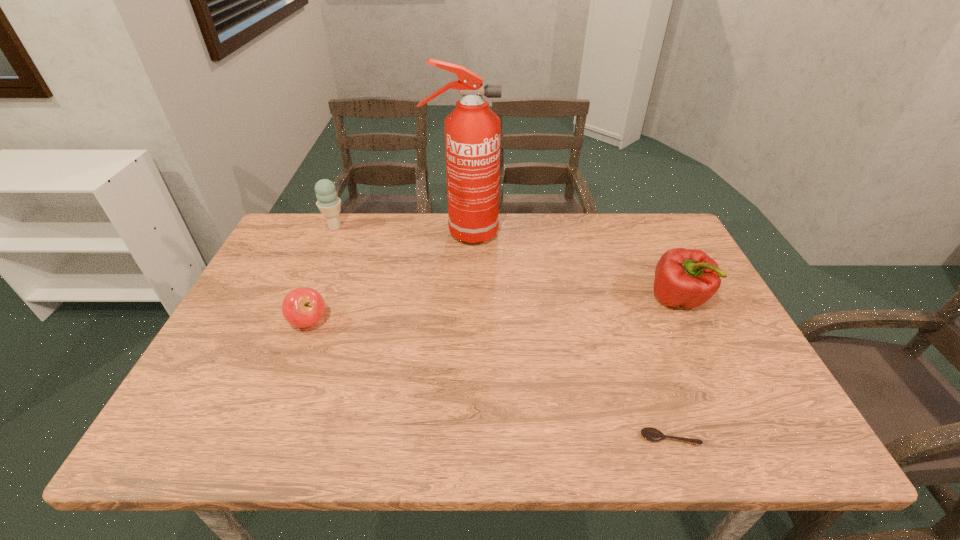
Image resolution: width=960 pixels, height=540 pixels. Find the location of `vacant space located 0.060m on the right of the second shortest object`. vacant space located 0.060m on the right of the second shortest object is located at coordinates (353, 321).

Where is `vacant point located 0.140m on the right of the soupspoon`? vacant point located 0.140m on the right of the soupspoon is located at coordinates (769, 438).

Locate an element on the screen. Image resolution: width=960 pixels, height=540 pixels. fire extinguisher that is at the far edge is located at coordinates (472, 130).

Identify the location of ice cream that is at the far edge. (328, 203).

Locate an element on the screen. object situated at the near edge is located at coordinates (652, 434).

Locate an element on the screen. Image resolution: width=960 pixels, height=540 pixels. ice cream present at the left edge is located at coordinates (328, 203).

Identify the location of apple that is positioned at the left edge. (303, 307).

Where is `object at the right edge`? object at the right edge is located at coordinates (684, 277).

You are a GUI agent. You are given a task and a screenshot of the screen. Output one action in this format:
    pyautogui.click(x=<x>, y=<y>)
    Task: Click on the object present at the far left corner
    The height and width of the screenshot is (540, 960).
    Given the screenshot: What is the action you would take?
    pyautogui.click(x=328, y=203)

You are a GUI agent. You are given a task and a screenshot of the screen. Output one action in this format:
    pyautogui.click(x=<x>, y=<y>)
    Task: Click on the vacant space at the far edge of the desktop
    This screenshot has height=540, width=960.
    Given the screenshot: What is the action you would take?
    pyautogui.click(x=417, y=240)